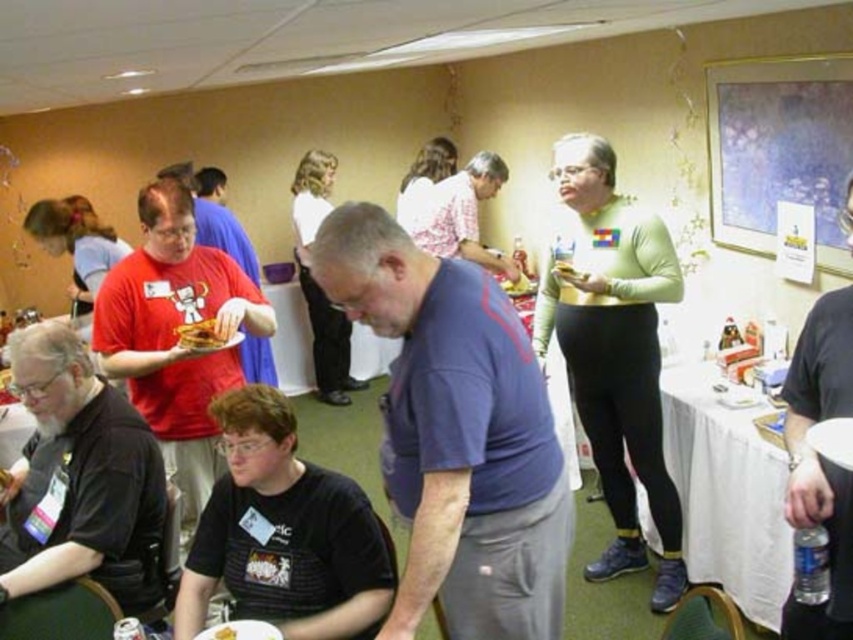
Question: Which point appears closest to the camera in this image?

Choices:
 (A) (229, 493)
 (B) (796, 449)
 (C) (425, 557)
 (D) (346, 385)

Answer: (C)

Question: Can you confirm if green spandex tights at right is smaller than golden crispy bread at center?

Choices:
 (A) yes
 (B) no

Answer: (B)

Question: Does black matte shirt at lower left have a smaller size compared to yellow matte cake at center?

Choices:
 (A) no
 (B) yes

Answer: (A)

Question: Which point is farther from the camera taking this photo?

Choices:
 (A) (628, 387)
 (B) (815, 348)
 (C) (314, 214)
 (D) (10, 548)

Answer: (C)

Question: Which point appears farthest from the camera in this image?

Choices:
 (A) click(x=376, y=579)
 (B) click(x=6, y=349)

Answer: (B)

Question: Can you confirm if blue cotton shirt at center is bigger than yellow matte cake at center?

Choices:
 (A) no
 (B) yes

Answer: (B)